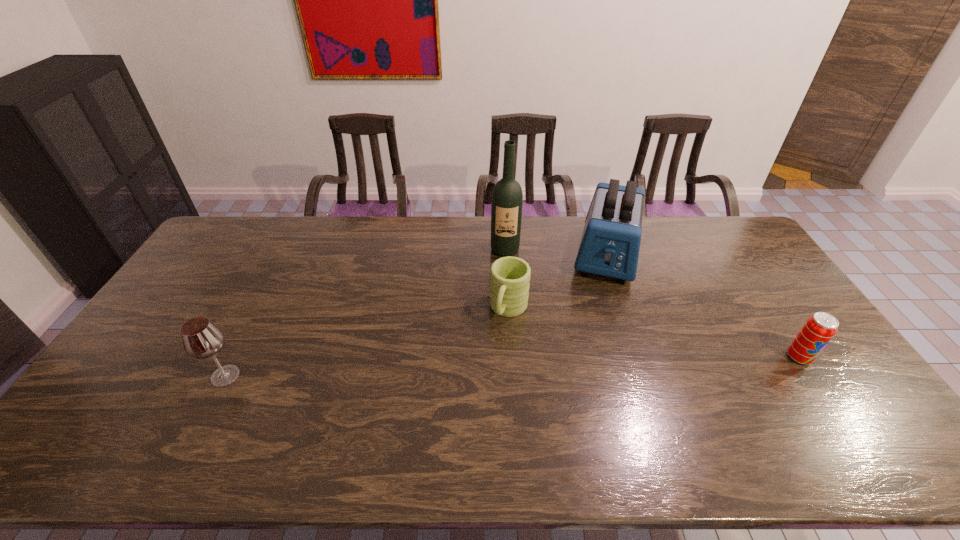
I want to click on vacant region located 0.280m on the labeled side of the tallest object, so click(x=506, y=317).

Locate an element on the screen. This screenshot has width=960, height=540. free space located 0.400m on the labeled side of the tallest object is located at coordinates (506, 348).

Locate an element on the screen. The width and height of the screenshot is (960, 540). vacant space located on the side of the mug with the handle is located at coordinates (472, 396).

Find the location of a particular element. free space located on the side of the mug with the handle is located at coordinates (492, 351).

Locate an element on the screen. The height and width of the screenshot is (540, 960). blank space located 0.100m on the side of the mug with the handle is located at coordinates (492, 353).

Where is `vacant space situated 0.300m on the front-facing side of the fourth object from left to right`? Image resolution: width=960 pixels, height=540 pixels. vacant space situated 0.300m on the front-facing side of the fourth object from left to right is located at coordinates (594, 357).

I want to click on blank space located 0.120m on the front-facing side of the fourth object from left to right, so click(x=601, y=313).

You are a GUI agent. You are given a task and a screenshot of the screen. Output one action in this format:
    pyautogui.click(x=<x>, y=<y>)
    Task: Click on the blank area located 0.180m on the front-facing side of the fourth object from left to right
    The height and width of the screenshot is (540, 960).
    Given the screenshot: What is the action you would take?
    pyautogui.click(x=599, y=327)

Where is `wine bottle positioned at the far edge`? wine bottle positioned at the far edge is located at coordinates (507, 198).

Where is `toaster that is at the far edge`? toaster that is at the far edge is located at coordinates (610, 243).